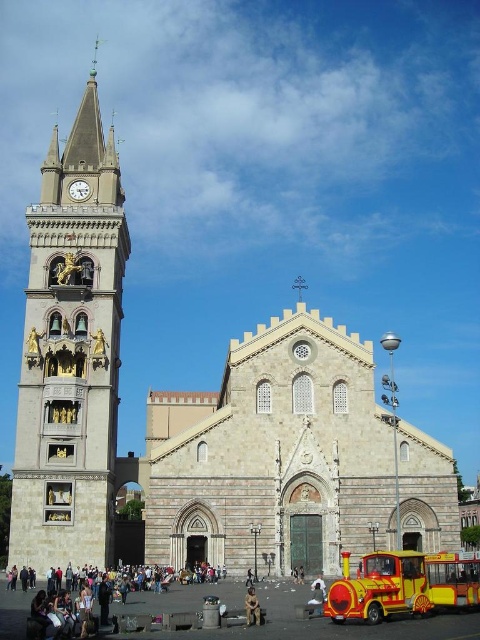
You are an architect visiting this historic church and want to compare the sizes of the dark gray stone person at lower left and the white marble clock at upper left. Which one is larger?

The dark gray stone person at lower left is bigger than the white marble clock at upper left according to the description.

You are standing in front of the church and notice the stone clock tower at left and the dark gray stone person at lower left. Which object is positioned higher from the ground?

The stone clock tower at left is above the dark gray stone person at lower left, so it is positioned higher from the ground.

You are standing in front of the historic church and want to take a photo of both the dark gray stone person at lower left and the white marble clock at upper left. Which object should you position lower in your camera frame?

You should position the dark gray stone person at lower left lower in your camera frame because it is located below the white marble clock at upper left.